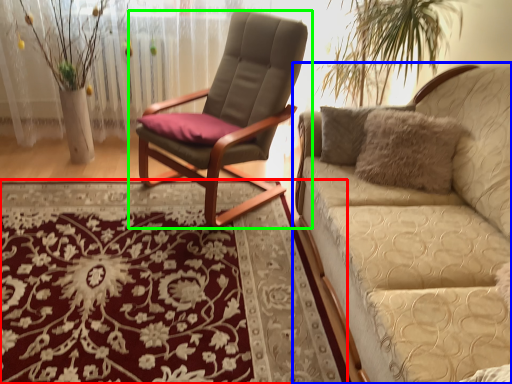
Question: Which is nearer to the mat (highlighted by a red box)? studio couch (highlighted by a blue box) or chair (highlighted by a green box).

Choices:
 (A) studio couch
 (B) chair

Answer: (B)